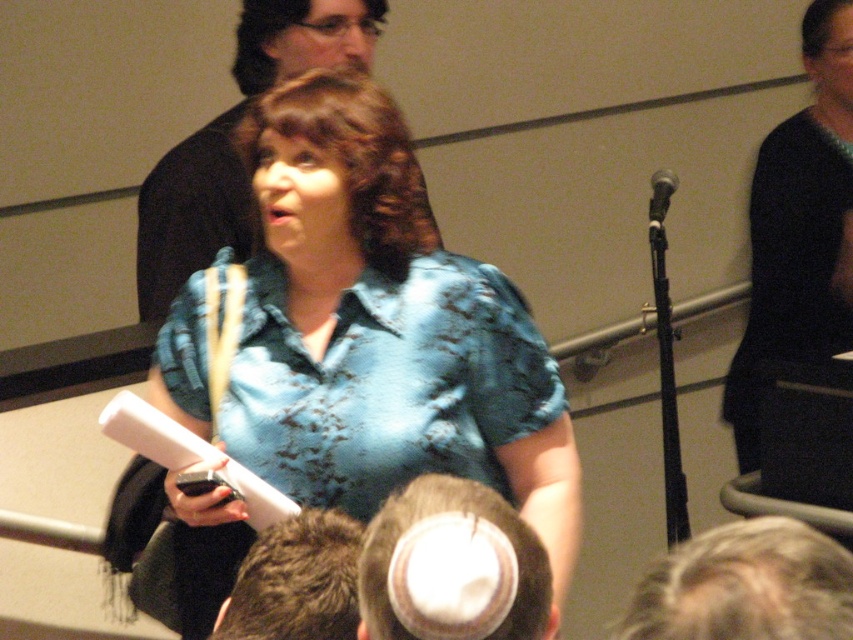
Between point (788, 298) and point (474, 584), which one is positioned in front?

Positioned in front is point (474, 584).

Does point (827, 280) come in front of point (401, 548)?

No, (827, 280) is behind (401, 548).

The width and height of the screenshot is (853, 640). Find the location of `black fabric at right`. black fabric at right is located at coordinates (799, 228).

At what (x,y) coordinates should I click in order to perform the action: click on black fabric at right. Please return your answer as a coordinate pair (x, y). Image resolution: width=853 pixels, height=640 pixels. Looking at the image, I should click on (799, 228).

The image size is (853, 640). What do you see at coordinates (381, 328) in the screenshot?
I see `blue silk blouse at center` at bounding box center [381, 328].

Does blue silk blouse at center have a greater height compared to brownshinyhair at center?

Indeed, blue silk blouse at center has a greater height compared to brownshinyhair at center.

Between point (405, 212) and point (254, 124), which one is positioned behind?

Positioned behind is point (405, 212).

This screenshot has width=853, height=640. In order to click on blue silk blouse at center in this screenshot , I will do `click(381, 328)`.

Describe the element at coordinates (381, 328) in the screenshot. I see `blue silk blouse at center` at that location.

Who is more forward, (264, 460) or (666, 186)?

Point (264, 460)

Between point (363, 349) and point (665, 195), which one is positioned in front?

Point (363, 349) is in front.

Locate an element on the screen. This screenshot has height=640, width=853. blue silk blouse at center is located at coordinates (381, 328).